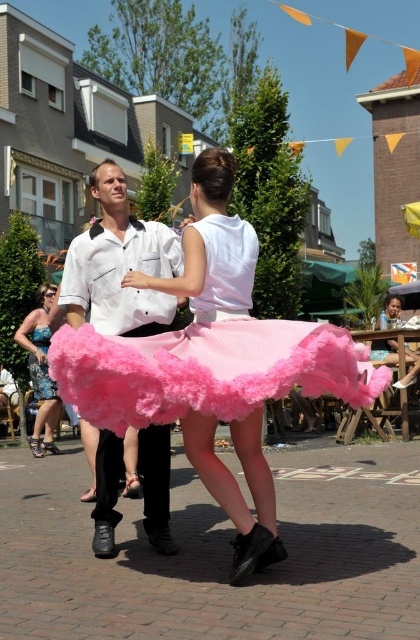
Between fuzzy pink skirt at center and shiny blue dress at lower left, which one has more height?

shiny blue dress at lower left is taller.

From the picture: Who is more distant from viewer, (277,376) or (55,397)?

The point (55,397) is more distant.

Is point (217, 237) positioned after point (31, 353)?

That is False.

Identify the location of fuzzy pink skirt at center. The width and height of the screenshot is (420, 640). (210, 353).

Is white matte shirt at center in front of shiny blue dress at lower left?

Yes, white matte shirt at center is in front of shiny blue dress at lower left.

Between point (91, 301) and point (49, 445), which one is positioned behind?

The point (49, 445) is behind.

The width and height of the screenshot is (420, 640). Identify the location of white matte shirt at center. [x=118, y=264].

Who is shorter, fuzzy pink skirt at center or white matte shirt at center?

With less height is white matte shirt at center.

Can you confirm if fuzzy pink skirt at center is taller than white matte shirt at center?

Indeed, fuzzy pink skirt at center has a greater height compared to white matte shirt at center.

Describe the element at coordinates (210, 353) in the screenshot. I see `fuzzy pink skirt at center` at that location.

Identify the location of fuzzy pink skirt at center. The height and width of the screenshot is (640, 420). (210, 353).